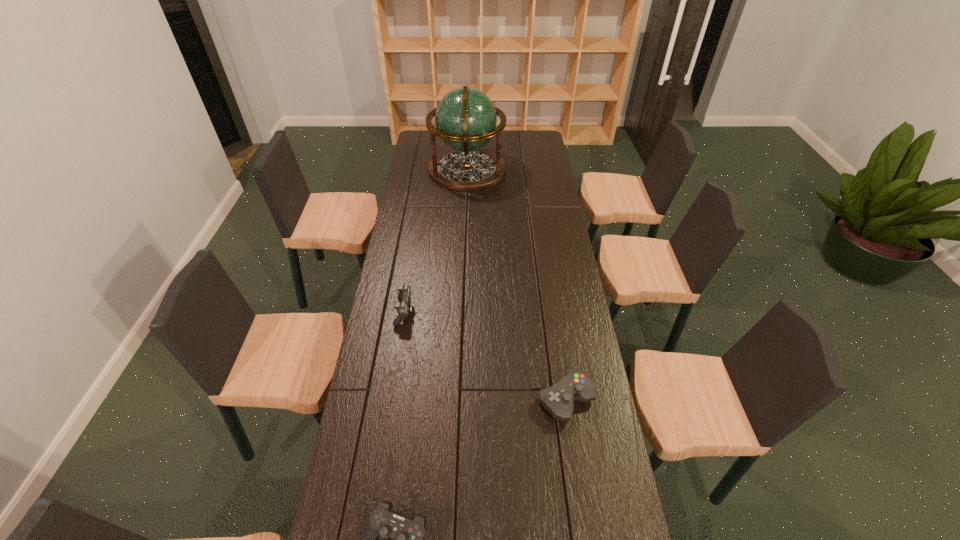
You are a GUI agent. You are given a task and a screenshot of the screen. Output one action in this format:
    pyautogui.click(x=<x>, y=<y>)
    Task: Click on the vacant space that satisfies the following two spatial constraints: 1. on the front-facing side of the rightmost object; 2. on the left side of the tallest object
    Image resolution: width=960 pixels, height=540 pixels.
    Given the screenshot: What is the action you would take?
    pyautogui.click(x=458, y=399)